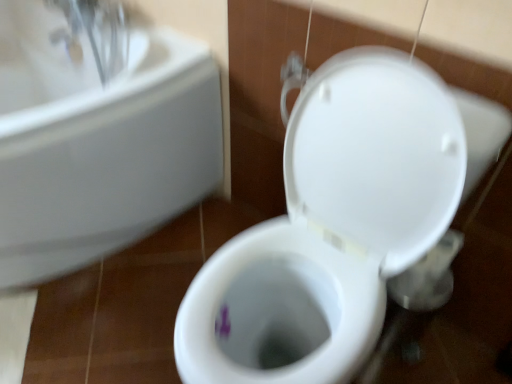
Question: In terms of width, does white ceramic sink at upper left look wider or thinner when compared to white glossy toilet at center?

Choices:
 (A) wide
 (B) thin

Answer: (A)

Question: Would you say white ceramic sink at upper left is to the left or to the right of white glossy toilet at center in the picture?

Choices:
 (A) right
 (B) left

Answer: (B)

Question: Is point (87, 120) closer or farther from the camera than point (349, 362)?

Choices:
 (A) closer
 (B) farther

Answer: (B)

Question: Visually, is white glossy toilet at center positioned to the left or to the right of white ceramic sink at upper left?

Choices:
 (A) left
 (B) right

Answer: (B)

Question: From the image's perspective, is white glossy toilet at center positioned above or below white ceramic sink at upper left?

Choices:
 (A) below
 (B) above

Answer: (A)

Question: Considering the positions of white glossy toilet at center and white ceramic sink at upper left in the image, is white glossy toilet at center taller or shorter than white ceramic sink at upper left?

Choices:
 (A) short
 (B) tall

Answer: (B)

Question: Looking at the image, does white glossy toilet at center seem bigger or smaller compared to white ceramic sink at upper left?

Choices:
 (A) small
 (B) big

Answer: (A)